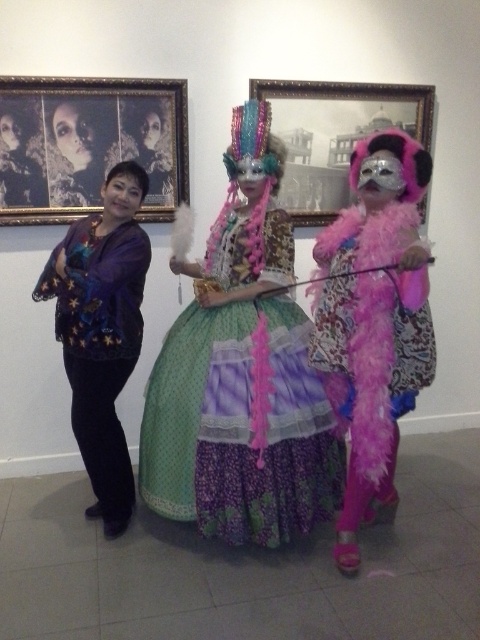
Question: Which of the following is the closest to the observer?

Choices:
 (A) (84, 381)
 (B) (177, 147)

Answer: (A)

Question: Which of the following is the farthest from the observer?

Choices:
 (A) (86, 468)
 (B) (228, 230)
 (C) (355, 353)

Answer: (A)

Question: Where is pastel polka dot dress at center located in relation to matte purple blouse at left in the image?

Choices:
 (A) right
 (B) left

Answer: (A)

Question: Is pastel polka dot dress at center above metallic silver picture frame at upper center?

Choices:
 (A) no
 (B) yes

Answer: (A)

Question: Among these objects, which one is nearest to the camera?

Choices:
 (A) metallic silver picture frame at upper center
 (B) matte purple blouse at left
 (C) gold-framed photograph at upper left

Answer: (B)

Question: Can you confirm if pastel polka dot dress at center is positioned to the left of metallic silver picture frame at upper center?

Choices:
 (A) no
 (B) yes

Answer: (B)